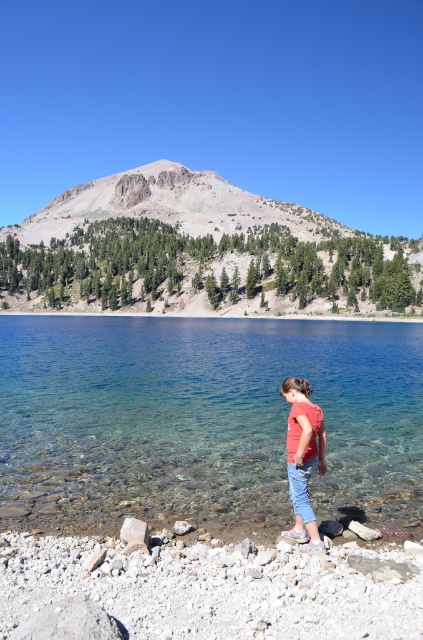
Question: Which of the following is the farthest from the observer?

Choices:
 (A) red cotton shirt at center
 (B) clear glass water at center

Answer: (B)

Question: Can you confirm if clear glass water at center is positioned above red cotton shirt at center?

Choices:
 (A) yes
 (B) no

Answer: (A)

Question: Is clear glass water at center to the left of red cotton shirt at center from the viewer's perspective?

Choices:
 (A) no
 (B) yes

Answer: (B)

Question: In this image, where is clear glass water at center located relative to red cotton shirt at center?

Choices:
 (A) left
 (B) right

Answer: (A)